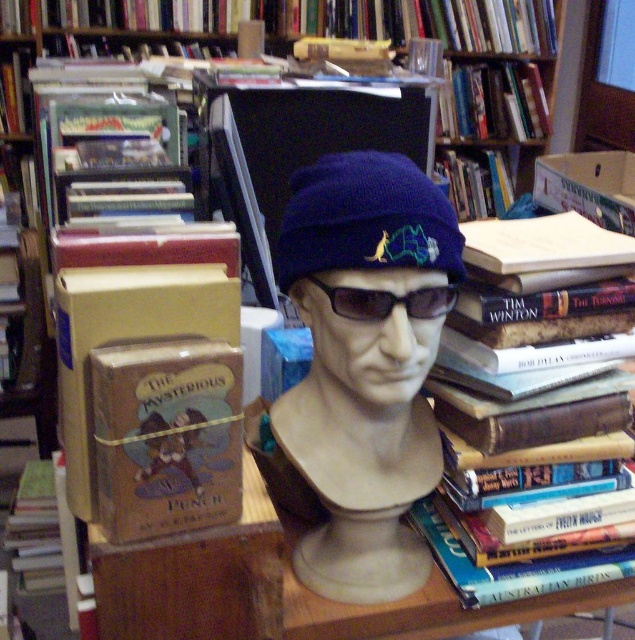
Which is below, blue knitted hat at center or black plastic goggles at center?

blue knitted hat at center is lower down.

What are the coordinates of `blue knitted hat at center` in the screenshot? It's located at (364, 364).

What do you see at coordinates (364, 364) in the screenshot? I see `blue knitted hat at center` at bounding box center [364, 364].

In the scene shown: Does blue knitted hat at center appear over navy blue knit beanie at center?

Incorrect, blue knitted hat at center is not positioned above navy blue knit beanie at center.

Find the location of a particular element. blue knitted hat at center is located at coordinates (364, 364).

Does navy blue knit beanie at center appear on the right side of black plastic goggles at center?

No, navy blue knit beanie at center is not to the right of black plastic goggles at center.

Can you confirm if navy blue knit beanie at center is taller than black plastic goggles at center?

Indeed, navy blue knit beanie at center has a greater height compared to black plastic goggles at center.

Does point (284, 221) come in front of point (398, 296)?

No, (284, 221) is further to viewer.

Where is `navy blue knit beanie at center`? The image size is (635, 640). navy blue knit beanie at center is located at coordinates (366, 220).